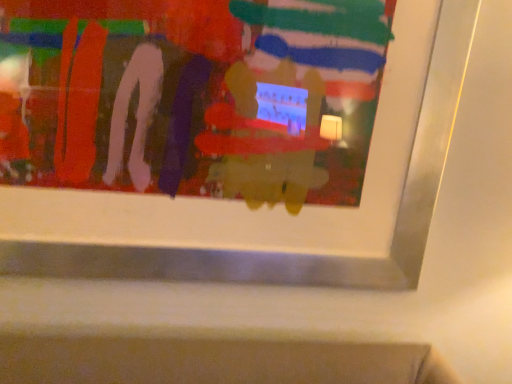
The height and width of the screenshot is (384, 512). What do you see at coordinates (229, 138) in the screenshot?
I see `metallic silver picture frame at upper center` at bounding box center [229, 138].

This screenshot has width=512, height=384. In order to click on metallic silver picture frame at upper center in this screenshot , I will do click(229, 138).

Locate an element on the screen. metallic silver picture frame at upper center is located at coordinates (229, 138).